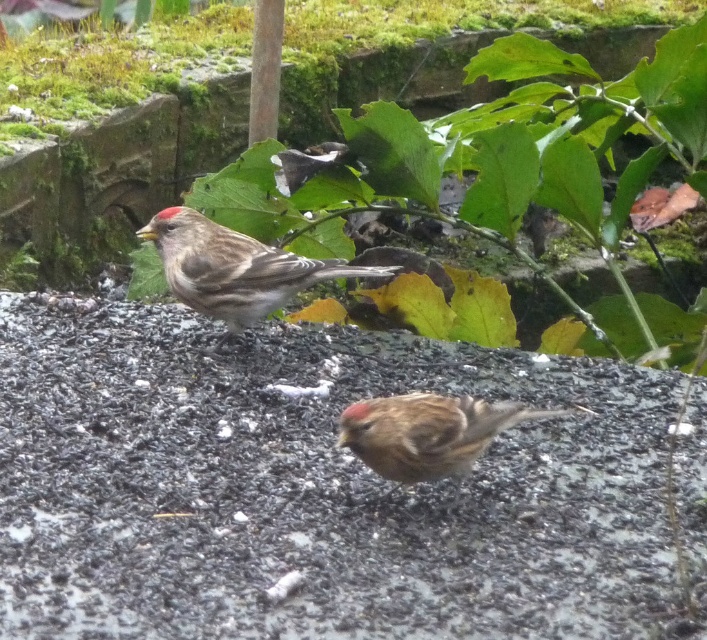
You are a birdwatcher observing two birds in the scene. You notice a specific point marked at coordinates (235, 268). Which bird is this point located on?

The point at coordinates (235, 268) is located on the brown matte sparrow at upper left.

You are a birdwatcher observing two sparrows in an outdoor setting. You see the brown matte sparrow at upper left and the brown feathered sparrow at center. Which sparrow has a greater width?

The brown matte sparrow at upper left might be wider than the brown feathered sparrow at center according to the description.

You are standing at a point 5.22 feet away from the point marked at coordinates point (607,433). If you want to move closer to that point, which direction should you move?

Since you are 5.22 feet away from point (607,433), you should move forward towards the point to get closer.